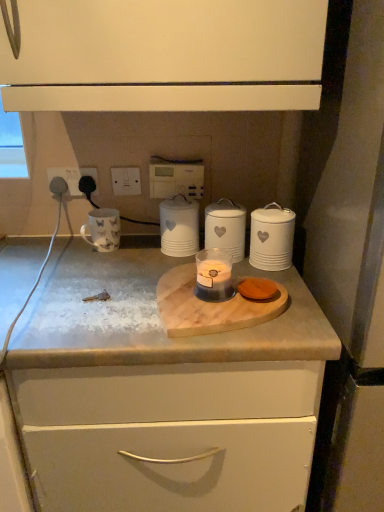
Locate an element on the screen. This screenshot has width=384, height=512. free location in front of white matte canister at center, which is counted as the 3th home appliance, starting from the right is located at coordinates (152, 271).